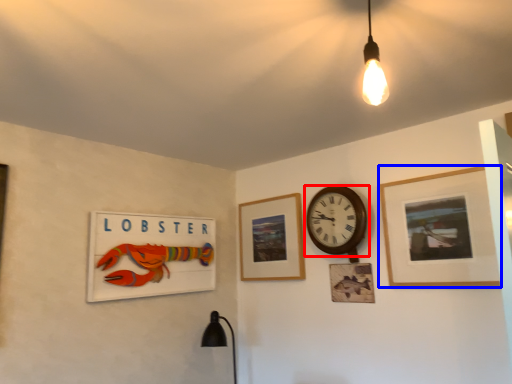
Question: Which object appears farthest to the camera in this image, wall clock (highlighted by a red box) or picture frame (highlighted by a blue box)?

Choices:
 (A) wall clock
 (B) picture frame

Answer: (A)